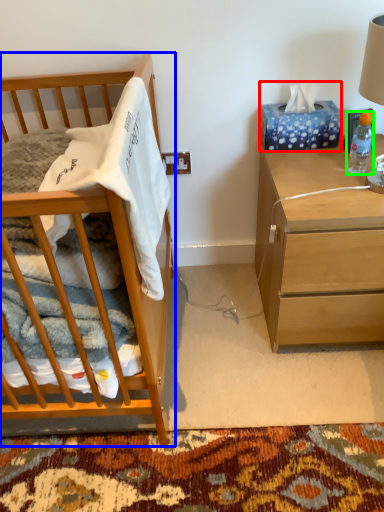
Question: Based on their relative distances, which object is nearer to tissue paper (highlighted by a red box)? Choose from cabinetry (highlighted by a blue box) and bottle (highlighted by a green box).

Choices:
 (A) cabinetry
 (B) bottle

Answer: (B)